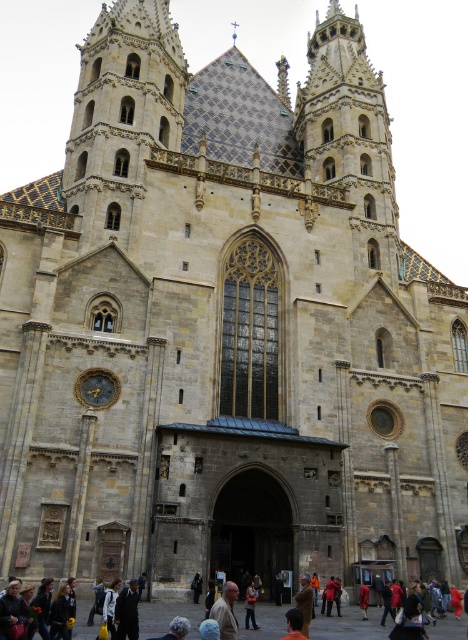
You are a photographer standing in front of the cathedral and notice the orange fabric shirt at lower center and the denim jacket at lower center. Which of these two items is positioned higher on the image?

The orange fabric shirt at lower center is taller than the denim jacket at lower center, so it is positioned higher.

You are a photographer standing in front of the cathedral and notice two items at the lower center of your viewfinder. These items are the orange fabric shirt at lower center and the denim jacket at lower center. Which one is located to the right of the other?

The orange fabric shirt at lower center is positioned on the right side of the denim jacket at lower center.

You are a security guard at the cathedral and need to fit a light brown leather jacket at lower center and a denim jacket at lower center into a storage locker. The locker has a width of 40 cm. Can you determine if both jackets can fit side by side?

The light brown leather jacket at lower center might be wider than denim jacket at lower center, so there is a possibility that the combined width of both jackets exceeds the locker width of 40 cm. Check the actual dimensions before placing them.